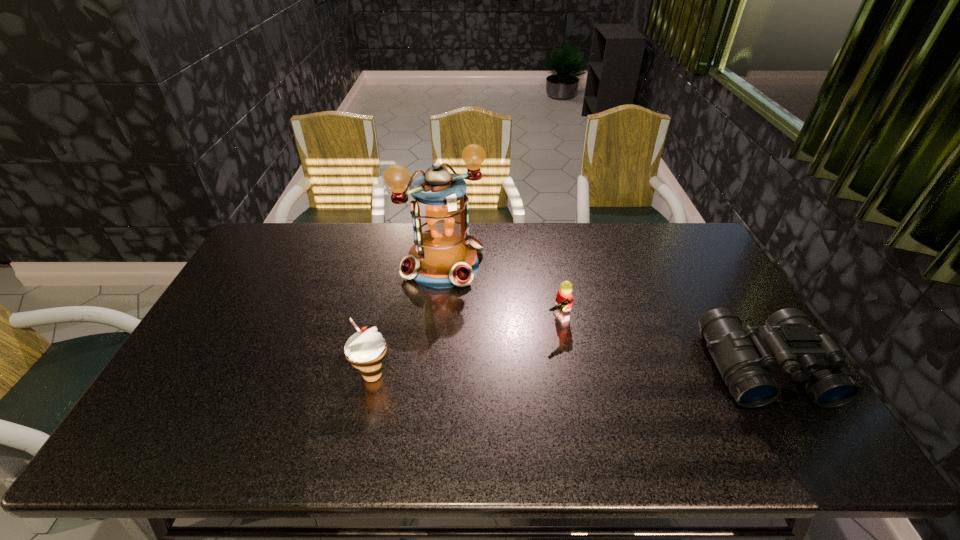
In order to click on vacant space positioned 0.190m in front of the shortest object with the accessory visible in this screenshot , I will do `click(606, 383)`.

Locate an element on the screen. The height and width of the screenshot is (540, 960). vacant space situated in front of the shortest object with the accessory visible is located at coordinates (594, 368).

At what (x,y) coordinates should I click in order to perform the action: click on vacant space located in front of the shortest object with the accessory visible. Please return your answer as a coordinate pair (x, y). The height and width of the screenshot is (540, 960). Looking at the image, I should click on (615, 395).

Where is `object that is at the far edge`? The height and width of the screenshot is (540, 960). object that is at the far edge is located at coordinates (444, 255).

Find the location of a particular element. icecream present at the near edge is located at coordinates (x=366, y=349).

At what (x,y) coordinates should I click in order to perform the action: click on binoculars located at the near edge. Please return your answer as a coordinate pair (x, y). Image resolution: width=960 pixels, height=540 pixels. Looking at the image, I should click on (743, 358).

Where is `object that is at the right edge`? object that is at the right edge is located at coordinates (743, 358).

Identify the location of object that is positioned at the near right corner. This screenshot has height=540, width=960. (743, 358).

Where is `vacant space at the far edge of the desktop`? vacant space at the far edge of the desktop is located at coordinates (663, 262).

The height and width of the screenshot is (540, 960). In the image, there is a desktop. What are the coordinates of `vacant region at the near edge` in the screenshot? It's located at point(232,409).